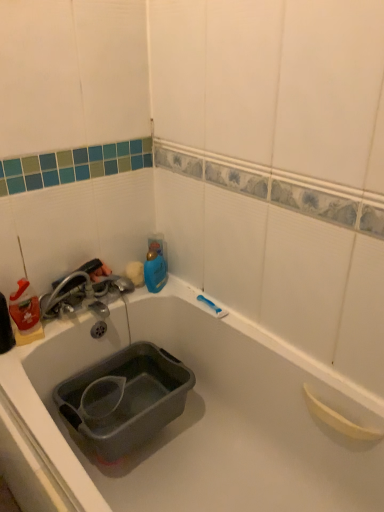
Question: Considering the relative sizes of metallic silver faucet at left and translucent plastic bottle at left in the image provided, is metallic silver faucet at left thinner than translucent plastic bottle at left?

Choices:
 (A) yes
 (B) no

Answer: (B)

Question: Considering the relative sizes of metallic silver faucet at left and translucent plastic bottle at left in the image provided, is metallic silver faucet at left bigger than translucent plastic bottle at left?

Choices:
 (A) no
 (B) yes

Answer: (B)

Question: Considering the relative sizes of metallic silver faucet at left and translucent plastic bottle at left in the image provided, is metallic silver faucet at left shorter than translucent plastic bottle at left?

Choices:
 (A) yes
 (B) no

Answer: (A)

Question: Is metallic silver faucet at left at the right side of translucent plastic bottle at left?

Choices:
 (A) yes
 (B) no

Answer: (A)

Question: Is metallic silver faucet at left oriented towards translucent plastic bottle at left?

Choices:
 (A) no
 (B) yes

Answer: (A)

Question: From the image's perspective, does metallic silver faucet at left appear higher than translucent plastic bottle at left?

Choices:
 (A) no
 (B) yes

Answer: (B)

Question: Is metallic silver faucet at left at the right side of blue plastic bottle at upper center?

Choices:
 (A) no
 (B) yes

Answer: (A)

Question: Is metallic silver faucet at left thinner than blue plastic bottle at upper center?

Choices:
 (A) yes
 (B) no

Answer: (B)

Question: Can you confirm if metallic silver faucet at left is shorter than blue plastic bottle at upper center?

Choices:
 (A) yes
 (B) no

Answer: (A)

Question: Can you confirm if metallic silver faucet at left is bigger than blue plastic bottle at upper center?

Choices:
 (A) yes
 (B) no

Answer: (A)

Question: Is metallic silver faucet at left with blue plastic bottle at upper center?

Choices:
 (A) no
 (B) yes

Answer: (A)

Question: Is metallic silver faucet at left located outside blue plastic bottle at upper center?

Choices:
 (A) yes
 (B) no

Answer: (A)

Question: Is translucent plastic bottle at left taller than metallic silver faucet at left?

Choices:
 (A) no
 (B) yes

Answer: (B)